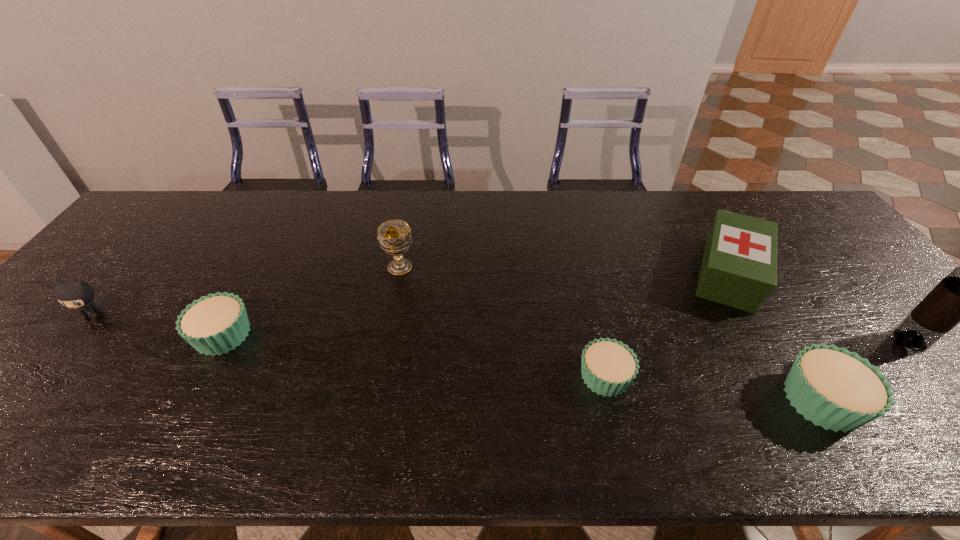
Locate an element on the screen. Image resolution: width=960 pixels, height=540 pixels. vacant spot for a new cupcake to ensure equal spacing is located at coordinates (406, 355).